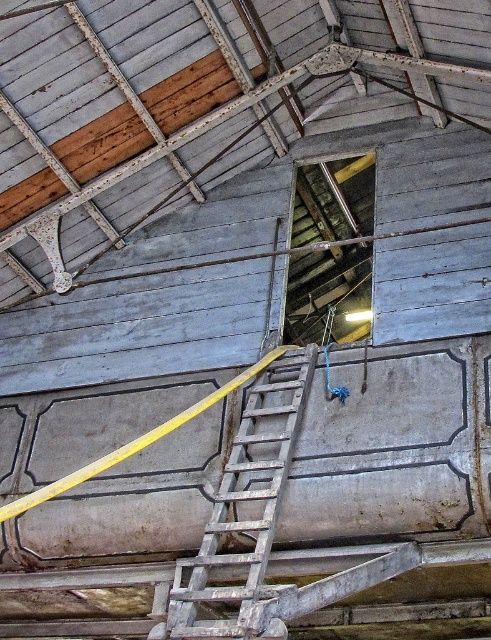
Question: Can you confirm if rusty metal roof at upper center is smaller than wooden at upper center?

Choices:
 (A) yes
 (B) no

Answer: (B)

Question: Is rusty metal roof at upper center positioned before wooden ladder at center?

Choices:
 (A) yes
 (B) no

Answer: (B)

Question: Is rusty metal roof at upper center behind wooden ladder at center?

Choices:
 (A) yes
 (B) no

Answer: (A)

Question: Among these objects, which one is farthest from the camera?

Choices:
 (A) wooden at upper center
 (B) wooden ladder at center
 (C) rusty metal roof at upper center

Answer: (A)

Question: Which point is closer to the camera?

Choices:
 (A) (245, 472)
 (B) (69, 97)
 (C) (326, 177)

Answer: (A)

Question: Based on their relative distances, which object is farther from the wooden at upper center?

Choices:
 (A) rusty metal roof at upper center
 (B) wooden ladder at center

Answer: (B)